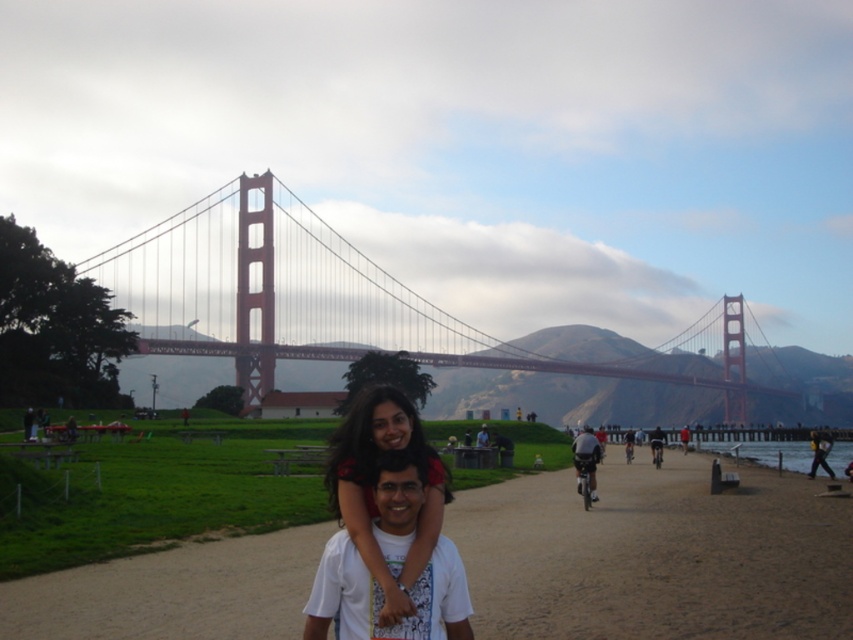
Based on the photo, you are a photographer trying to capture a closeup of the dark blue helmet at center and the matte black bicycle at center. Which object should you zoom in on to ensure both are in focus without moving the camera?

The dark blue helmet at center has a larger width than the matte black bicycle at center, so you should zoom in on the dark blue helmet at center to ensure both are in focus without moving the camera.

You are a photographer trying to capture the scene of the two people at the Golden Gate Bridge. You notice the matte black hair at center and the dark gray helmet at center in your viewfinder. Which object should you adjust your camera to focus on first if you want to ensure both are in the frame but prioritize the one closer to the edge?

You should focus on the matte black hair at center first because it is to the left of the dark gray helmet at center, making it closer to the edge of the frame. By starting there, you can ensure both objects remain within the camera view while prioritizing the one nearer the edge.

Based on the scene description, where exactly is the matte black hair at center located in terms of coordinates?

The matte black hair at center is located at point coordinates of (370, 488).